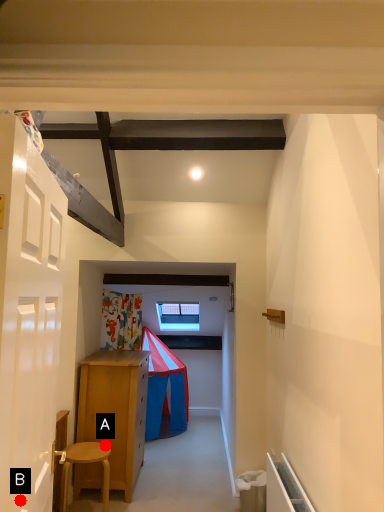
Question: Two points are circled on the image, labeled by A and B beside each circle. Which of the following is the farthest from the observer?

Choices:
 (A) A is further
 (B) B is further

Answer: (A)